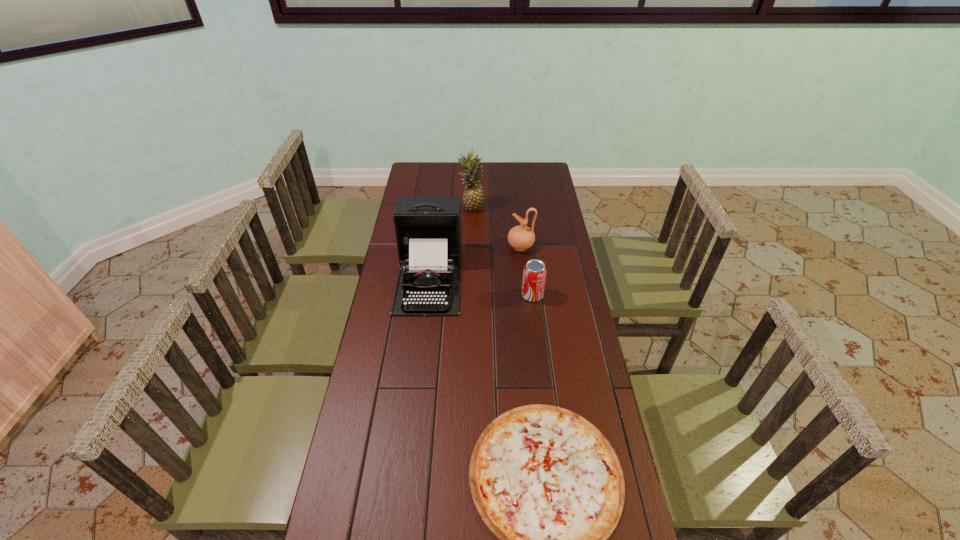
This screenshot has height=540, width=960. In order to click on object present at the left edge in this screenshot , I will do tap(428, 229).

Find the location of a particular element. The width and height of the screenshot is (960, 540). pottery that is at the right edge is located at coordinates (521, 238).

Locate an element on the screen. soda can that is at the right edge is located at coordinates (534, 274).

Where is `free region at the far edge`? free region at the far edge is located at coordinates (444, 168).

The height and width of the screenshot is (540, 960). In order to click on vacant space at the left edge of the desktop in this screenshot , I will do [x=398, y=325].

Find the location of `vacant space at the right edge of the desktop`. vacant space at the right edge of the desktop is located at coordinates (574, 307).

Identify the location of vacant area at the far left corner of the desktop. The image size is (960, 540). (430, 172).

The height and width of the screenshot is (540, 960). Find the location of `vacant space at the far right corner`. vacant space at the far right corner is located at coordinates (539, 182).

You are a GUI agent. You are given a task and a screenshot of the screen. Output one action in this format:
    pyautogui.click(x=<x>, y=<y>)
    Task: Click on the unoccupied area between the typewriter and the third tallest object
    This screenshot has width=960, height=540.
    Given the screenshot: What is the action you would take?
    tap(475, 262)

Locate an element on the screen. The image size is (960, 540). vacant space that is in between the soda can and the pineapple is located at coordinates (502, 252).